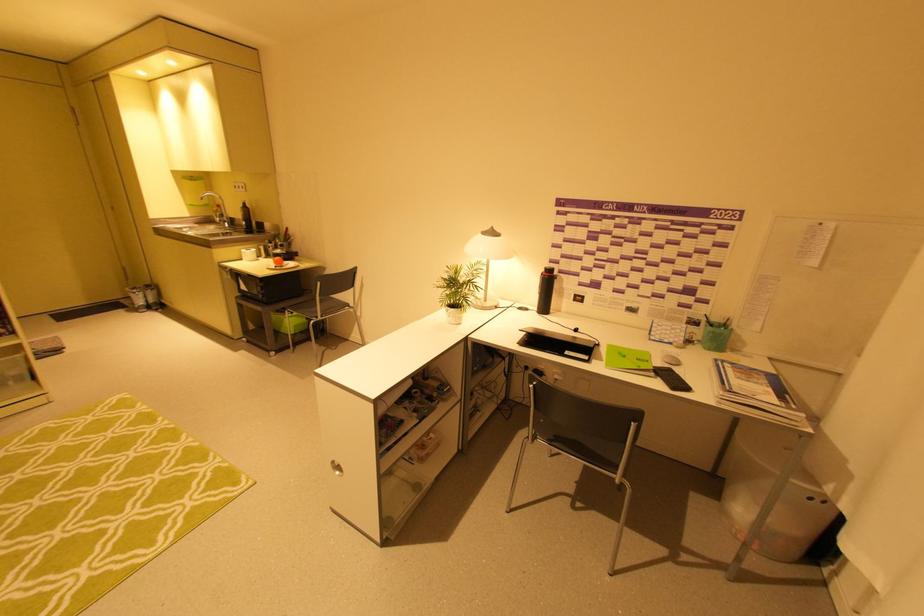
Where would you lift the green pen holder? Please return your answer as a coordinate pair (x, y).

(715, 334)